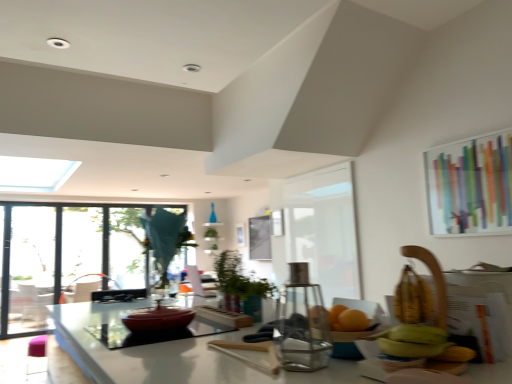
Question: Is colorful glass window screen at upper right in front of or behind white matte screen door at center, which is counted as the second screen door, starting from the back, in the image?

Choices:
 (A) behind
 (B) front

Answer: (B)

Question: Choose the correct answer: Is colorful glass window screen at upper right inside white matte screen door at center, placed as the second screen door when sorted from left to right, or outside it?

Choices:
 (A) outside
 (B) inside

Answer: (A)

Question: Which is nearer to the clear glass screen door at left, which is the 2th screen door from right to left?

Choices:
 (A) transparent glass table at center
 (B) white matte screen door at center, the 1th screen door viewed from the front
 (C) green matte plant at center
 (D) transparent glass window at left
 (E) colorful glass window screen at upper right

Answer: (D)

Question: Estimate the real-world distances between objects in this image. Which object is closer to the white matte screen door at center, placed as the second screen door when sorted from left to right?

Choices:
 (A) clear glass screen door at left, which is the 2th screen door from right to left
 (B) transparent glass table at center
 (C) green matte plant at center
 (D) transparent glass window at left
 (E) colorful glass window screen at upper right

Answer: (E)